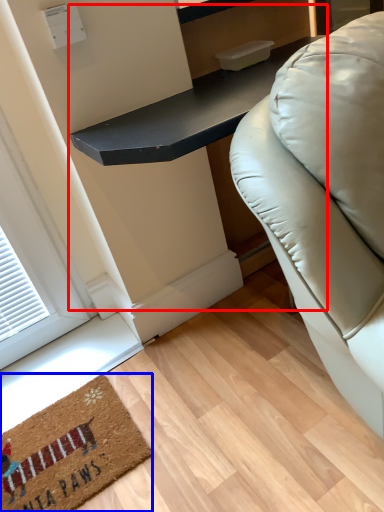
Question: Which point is further to the camera, table (highlighted by a red box) or mat (highlighted by a blue box)?

Choices:
 (A) table
 (B) mat

Answer: (B)